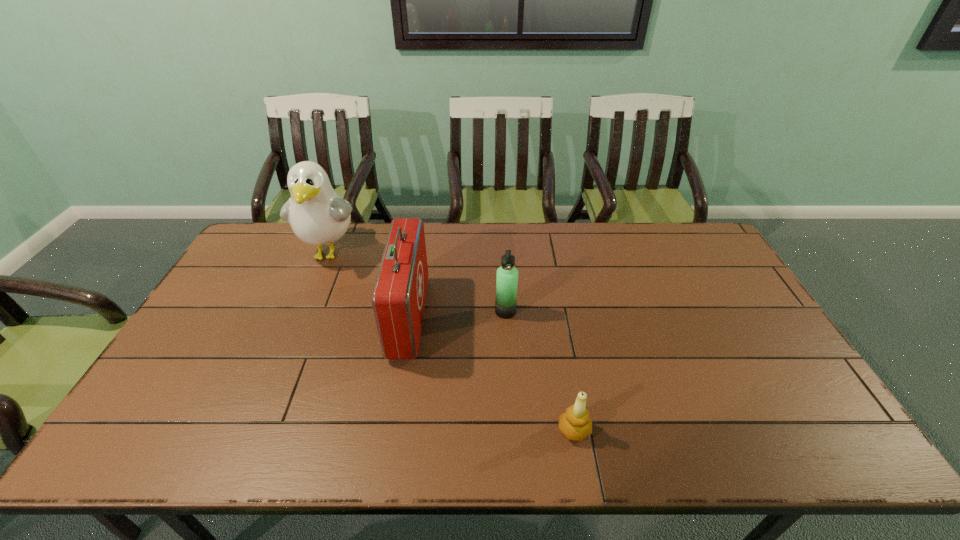
Where is `free location located 0.330m on the back of the thermos bottle`? free location located 0.330m on the back of the thermos bottle is located at coordinates (501, 240).

Image resolution: width=960 pixels, height=540 pixels. I want to click on vacant area situated on the left of the rightmost object, so click(518, 430).

Image resolution: width=960 pixels, height=540 pixels. Identify the location of object that is positioned at the far edge. (318, 215).

Locate an element on the screen. Image resolution: width=960 pixels, height=540 pixels. object positioned at the near edge is located at coordinates (575, 423).

Find the location of a particular element. free space at the far edge of the desktop is located at coordinates (449, 239).

In the image, there is a desktop. Identify the location of vacant space at the near edge. (463, 435).

I want to click on vacant space at the right edge, so click(745, 339).

At what (x,y) coordinates should I click in order to perform the action: click on free space at the far right corner. Please return your answer as a coordinate pair (x, y). Looking at the image, I should click on (688, 247).

At what (x,y) coordinates should I click in order to perform the action: click on free region at the near right corner of the desktop. Please return your answer as a coordinate pair (x, y). Image resolution: width=960 pixels, height=540 pixels. Looking at the image, I should click on (806, 422).

Where is `unoccupied area between the leftmost object and the rightmost object`? This screenshot has height=540, width=960. unoccupied area between the leftmost object and the rightmost object is located at coordinates (452, 342).